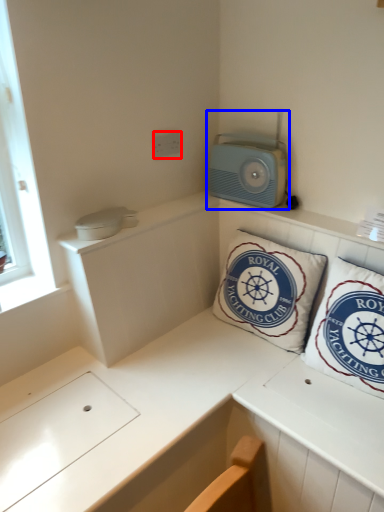
Question: Which of the following is the farthest to the observer, electric outlet (highlighted by a red box) or appliance (highlighted by a blue box)?

Choices:
 (A) electric outlet
 (B) appliance

Answer: (A)